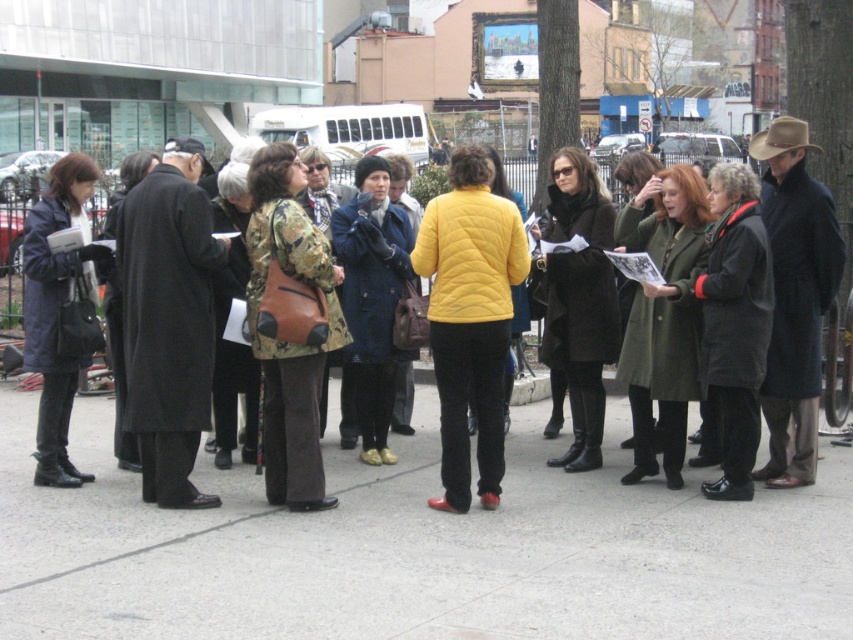
Does quilted yellow jacket at center appear on the left side of quilted navy coat at left?

No, quilted yellow jacket at center is not to the left of quilted navy coat at left.

Is point (463, 170) farther from camera compared to point (61, 328)?

No, (463, 170) is closer to viewer.

Describe the element at coordinates (469, 320) in the screenshot. This screenshot has width=853, height=640. I see `quilted yellow jacket at center` at that location.

You are a GUI agent. You are given a task and a screenshot of the screen. Output one action in this format:
    pyautogui.click(x=<x>, y=<y>)
    Task: Click on the quilted yellow jacket at center
    The image size is (853, 640).
    Given the screenshot: What is the action you would take?
    pyautogui.click(x=469, y=320)

Does quilted yellow jacket at center appear on the right side of matte brown coat at center?

Correct, you'll find quilted yellow jacket at center to the right of matte brown coat at center.

Is point (445, 234) positioned behind point (357, 324)?

No, (445, 234) is closer to viewer.

What do you see at coordinates (469, 320) in the screenshot? I see `quilted yellow jacket at center` at bounding box center [469, 320].

Identify the location of quilted yellow jacket at center. The width and height of the screenshot is (853, 640). (469, 320).

Does camouflage fabric jacket at center appear on the right side of camouflage jacket at center?

Indeed, camouflage fabric jacket at center is positioned on the right side of camouflage jacket at center.

Who is shorter, camouflage fabric jacket at center or camouflage jacket at center?

With less height is camouflage jacket at center.

At what (x,y) coordinates should I click in order to perform the action: click on camouflage fabric jacket at center. Please return your answer as a coordinate pair (x, y). This screenshot has width=853, height=640. Looking at the image, I should click on (289, 324).